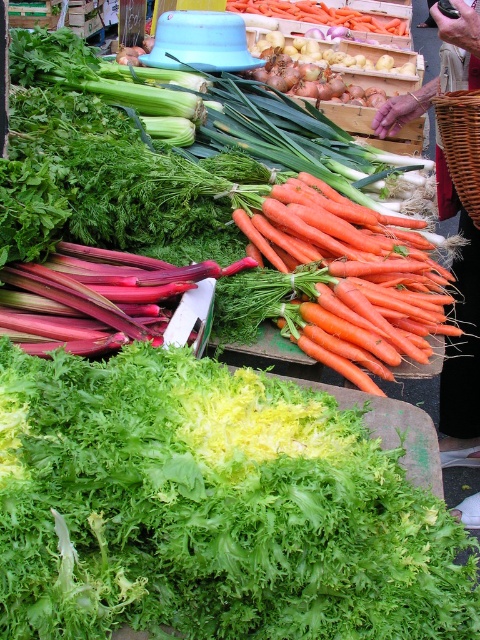
Can you confirm if green leafy lettuce at center is shorter than woven brown basket at center-right?

Incorrect, green leafy lettuce at center's height does not fall short of woven brown basket at center-right's.

From the picture: Does green leafy lettuce at center appear on the right side of woven brown basket at center-right?

No, green leafy lettuce at center is not to the right of woven brown basket at center-right.

Where is `green leafy lettuce at center`? green leafy lettuce at center is located at coordinates (212, 518).

Image resolution: width=480 pixels, height=640 pixels. In order to click on green leafy lettuce at center in this screenshot , I will do `click(212, 518)`.

Is orange smooth carrots at center positioned behind woven brown basket at center-right?

No.

Does point (436, 296) come behind point (458, 202)?

No, (436, 296) is in front of (458, 202).

The width and height of the screenshot is (480, 640). Describe the element at coordinates (349, 276) in the screenshot. I see `orange smooth carrots at center` at that location.

Find the location of `orange smooth carrots at center`. orange smooth carrots at center is located at coordinates (349, 276).

Is green leafy lettuce at center shorter than orange smooth carrots at center?

Yes.

Which of these two, green leafy lettuce at center or orange smooth carrots at center, stands taller?

With more height is orange smooth carrots at center.

Does point (13, 508) come farther from viewer compared to point (402, 234)?

No, it is not.

You are a GUI agent. You are given a task and a screenshot of the screen. Output one action in this format:
    pyautogui.click(x=<x>, y=<y>)
    Task: Click on the green leafy lettuce at center
    
    Given the screenshot: What is the action you would take?
    pyautogui.click(x=212, y=518)